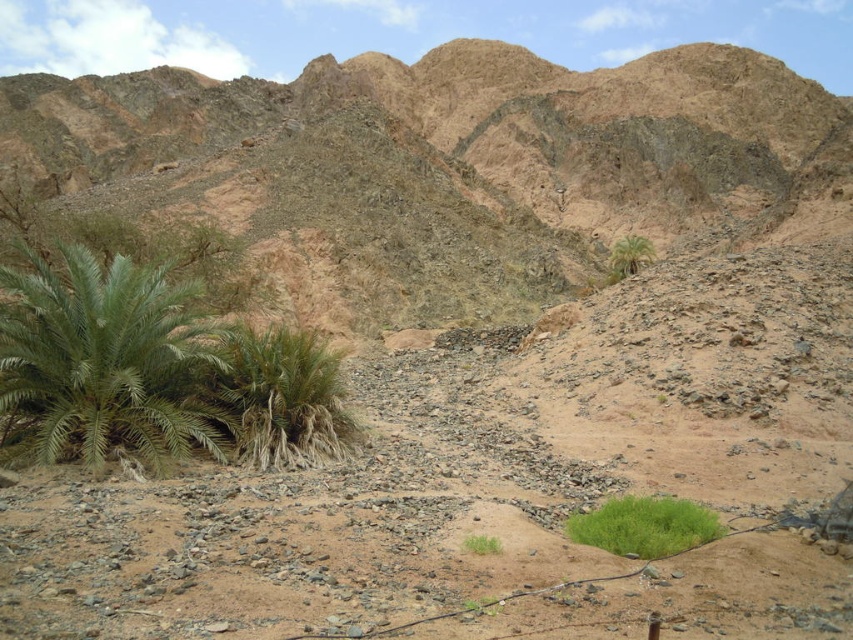
Is point (59, 317) positioned before point (473, 538)?

No, it is behind (473, 538).

This screenshot has width=853, height=640. What are the coordinates of `green leafy palm at lower left` in the screenshot? It's located at (107, 358).

Is dull brown rock at upper center in front of green leafy palm at lower left?

No, dull brown rock at upper center is behind green leafy palm at lower left.

This screenshot has height=640, width=853. What are the coordinates of `dull brown rock at upper center` in the screenshot? It's located at (440, 161).

Measure the distance between dull brown rock at upper center and green leafy bush at center.

dull brown rock at upper center is 126.18 meters away from green leafy bush at center.

Who is more distant from viewer, (474, 134) or (639, 518)?

Point (474, 134)

I want to click on dull brown rock at upper center, so point(440,161).